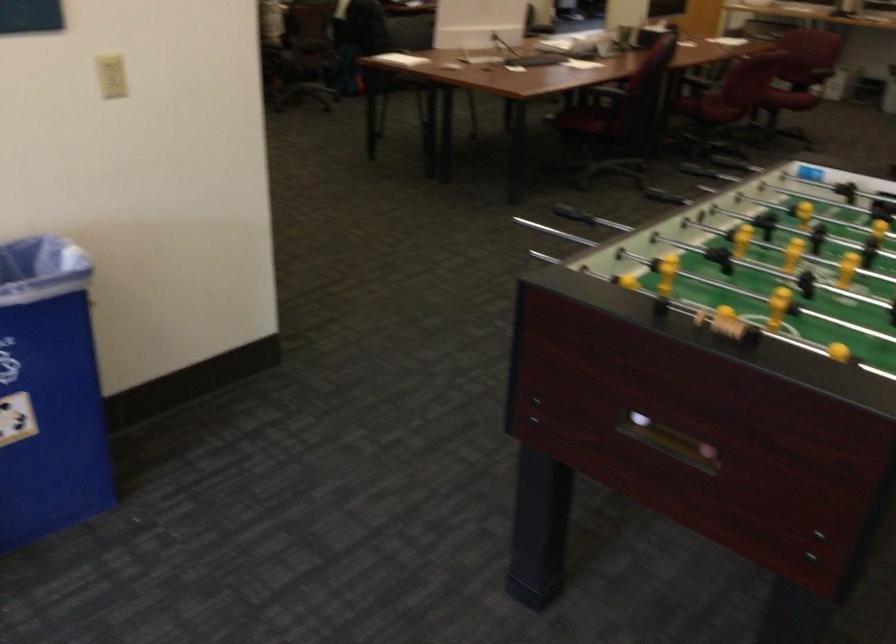
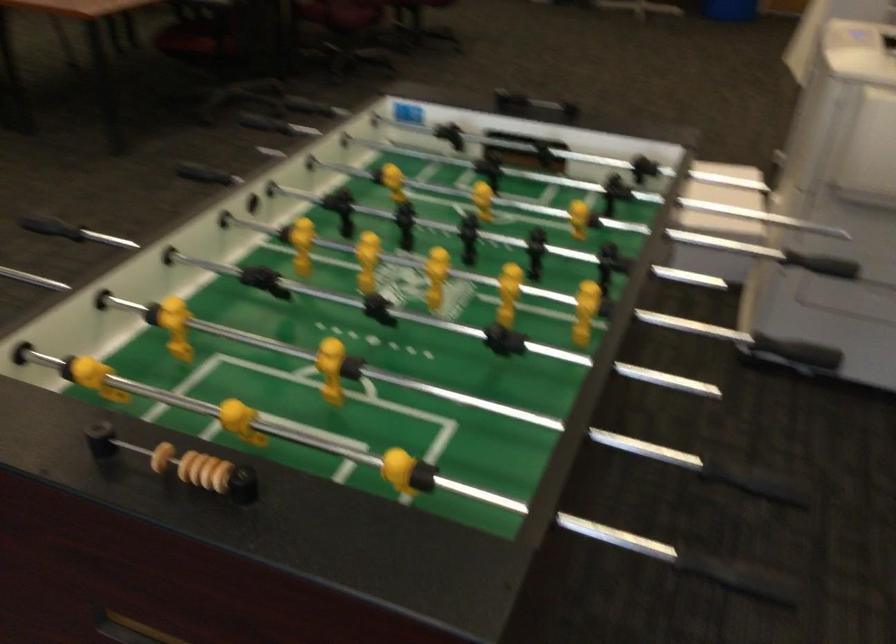
The point at (718, 319) is marked in the first image. Where is the corresponding point in the second image?

(186, 465)